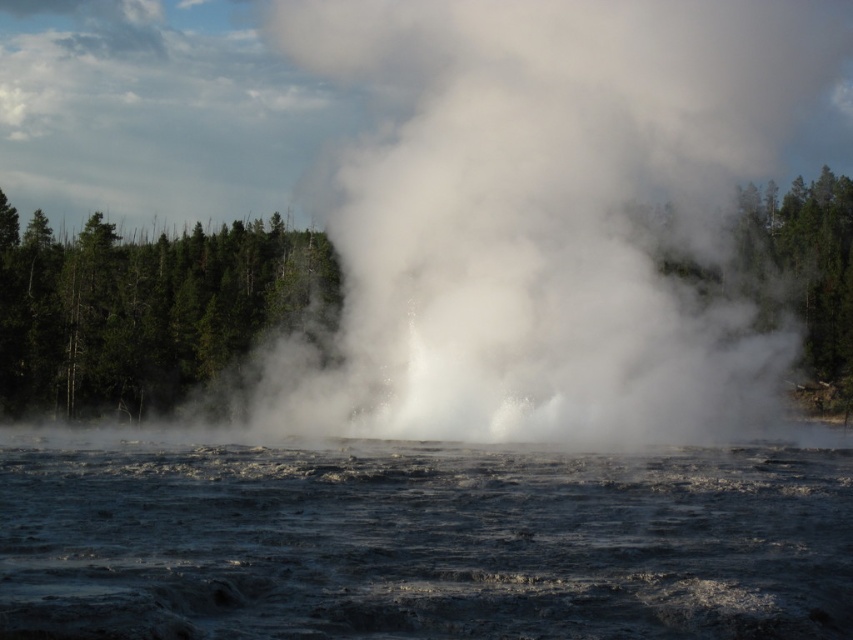
Which is behind, point (636, 260) or point (97, 410)?

Point (97, 410)

Can you confirm if white vapor at center is positioned below green matte tree at left?

No, white vapor at center is not below green matte tree at left.

Does point (315, 364) come in front of point (9, 321)?

Yes, it is in front of point (9, 321).

In order to click on white vapor at center in this screenshot , I will do `click(546, 216)`.

Is point (368, 608) closer to camera compared to point (212, 291)?

Yes, point (368, 608) is in front of point (212, 291).

Which is below, translucent dark water at center or green matte tree at left?

translucent dark water at center is lower down.

Find the location of a particular element. The image size is (853, 640). translucent dark water at center is located at coordinates (422, 541).

What are the coordinates of `translucent dark water at center` in the screenshot? It's located at (422, 541).

Is point (825, 22) positioned after point (241, 490)?

That is True.

Who is more distant from viewer, (x=576, y=212) or (x=309, y=454)?

Point (x=576, y=212)

Identify the location of white vapor at center. (546, 216).